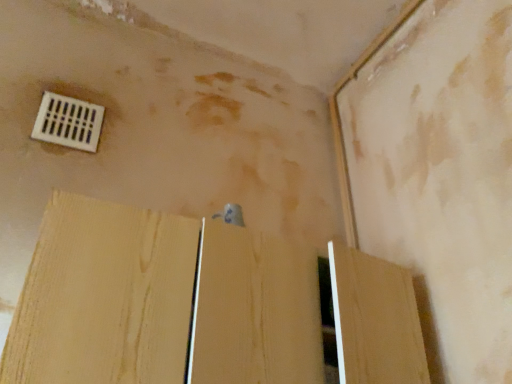
Locate an element on the screen. The width and height of the screenshot is (512, 384). wooden door at center is located at coordinates (162, 302).

Measure the distance between wooden door at center and camera.

The depth of wooden door at center is 26.14 inches.

What do you see at coordinates (162, 302) in the screenshot? The width and height of the screenshot is (512, 384). I see `wooden door at center` at bounding box center [162, 302].

In order to face wooden door at center, should I rotate leftwards or rightwards?

You should look left and rotate roughly 1.982 degrees.

Find the location of `wooden door at center`. wooden door at center is located at coordinates (162, 302).